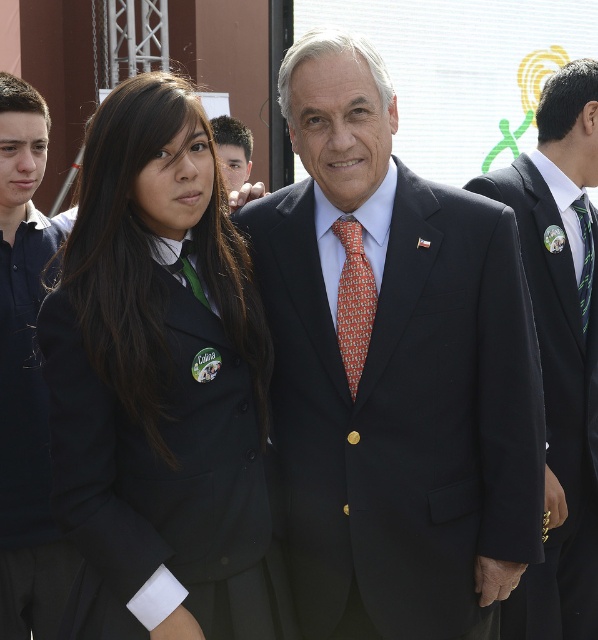
Looking at this image, measure the distance between satin black suit at center and green silk tie at center.

satin black suit at center and green silk tie at center are 5.47 feet apart.

Between satin black suit at center and green silk tie at center, which one appears on the right side from the viewer's perspective?

From the viewer's perspective, green silk tie at center appears more on the right side.

Is point (425, 412) positioned behind point (590, 244)?

No, it is in front of (590, 244).

The image size is (598, 640). In order to click on satin black suit at center in this screenshot , I will do `click(395, 372)`.

Who is higher up, black suit at center or orange printed tie at center?

orange printed tie at center

Who is more distant from viewer, (548, 488) or (367, 333)?

The point (548, 488) is more distant.

Image resolution: width=598 pixels, height=640 pixels. Find the location of `black suit at center`. black suit at center is located at coordinates (559, 352).

Does satin black suit at center have a greater width compared to black fabric uniform at left?

Correct, the width of satin black suit at center exceeds that of black fabric uniform at left.

Which is in front, point (477, 413) or point (173, 474)?

Positioned in front is point (173, 474).

Find the location of a particular element. The width and height of the screenshot is (598, 640). satin black suit at center is located at coordinates (395, 372).